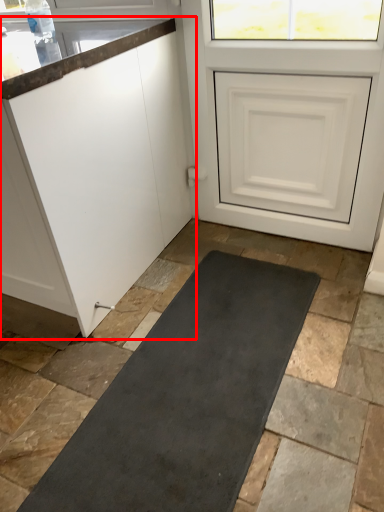
Question: From the image's perspective, what is the correct spatial positioning of cabinetry (annotated by the red box) in reference to door?

Choices:
 (A) above
 (B) below

Answer: (B)